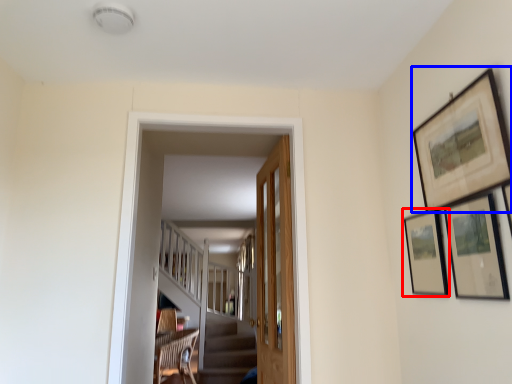
Question: Which point is closer to the camera, picture frame (highlighted by a red box) or picture frame (highlighted by a blue box)?

Choices:
 (A) picture frame
 (B) picture frame

Answer: (B)